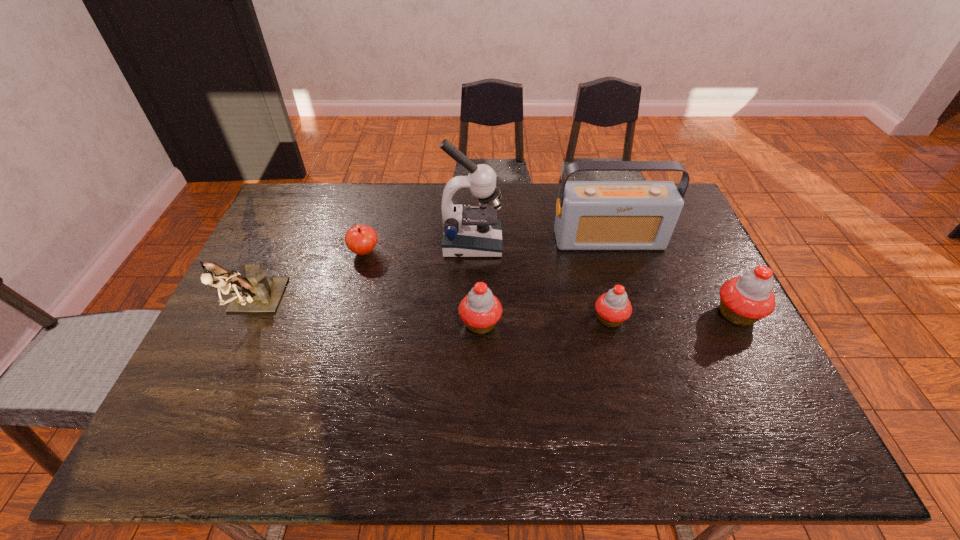
Find the location of a particular element. the second shortest cupcake is located at coordinates (480, 310).

I want to click on the leftmost cupcake, so click(480, 310).

This screenshot has height=540, width=960. In order to click on the shortest cupcake in this screenshot , I will do `click(613, 308)`.

You are a GUI agent. You are given a task and a screenshot of the screen. Output one action in this format:
    pyautogui.click(x=<x>, y=<y>)
    Task: Click on the second cupcake from right to left
    The width and height of the screenshot is (960, 540).
    Given the screenshot: What is the action you would take?
    pyautogui.click(x=613, y=308)

Locate an element on the screen. the rightmost cupcake is located at coordinates (744, 300).

You are a GUI agent. You are given a task and a screenshot of the screen. Output one action in this format:
    pyautogui.click(x=<x>, y=<y>)
    Task: Click on the shortest object
    The image size is (960, 540).
    Given the screenshot: What is the action you would take?
    pyautogui.click(x=360, y=239)

Identify the location of apple. (360, 239).

Where is `microscope`? This screenshot has width=960, height=540. microscope is located at coordinates (474, 232).

Locate an element on the screen. Image resolution: width=960 pixels, height=540 pixels. radio receiver is located at coordinates (590, 215).

At what (x,y) coordinates should I click in order to perform the action: click on figurine. Please return your answer as a coordinate pair (x, y). Looking at the image, I should click on (253, 291).